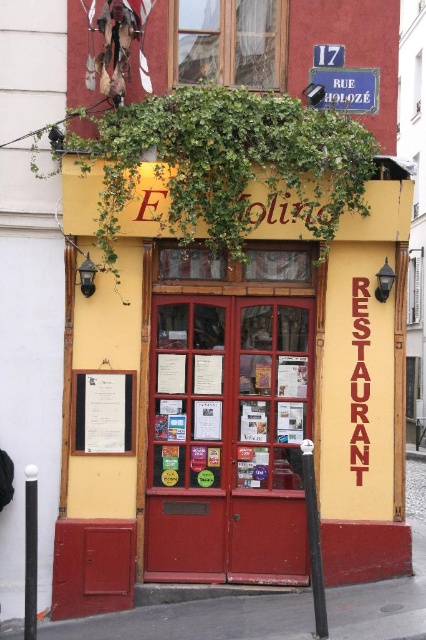
Is green leafy ivy at upper center shorter than white paper menu at center?

In fact, green leafy ivy at upper center may be taller than white paper menu at center.

Which is behind, point (207, 150) or point (100, 429)?

The point (100, 429) is behind.

Is point (324, 172) farther from camera compared to point (100, 376)?

No.

At what (x,y) coordinates should I click in order to perform the action: click on green leafy ivy at upper center. Please return your answer as a coordinate pair (x, y). This screenshot has height=640, width=426. Looking at the image, I should click on (227, 163).